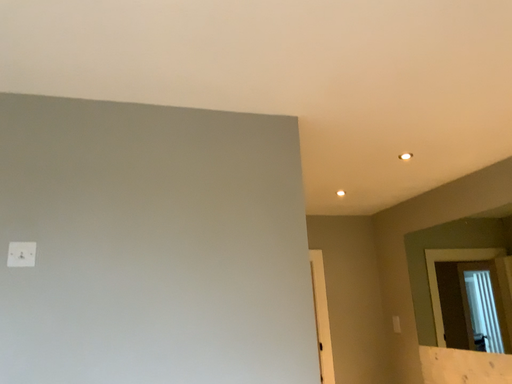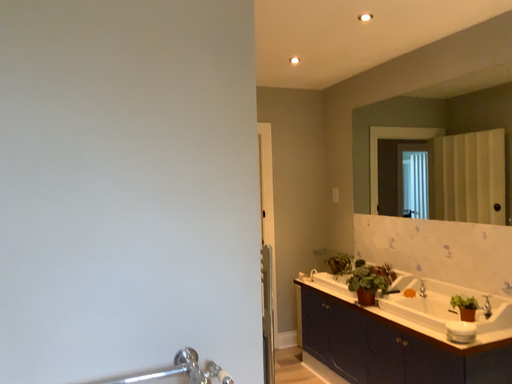
Question: Which way did the camera rotate in the video?

Choices:
 (A) rotated downward
 (B) rotated upward

Answer: (A)